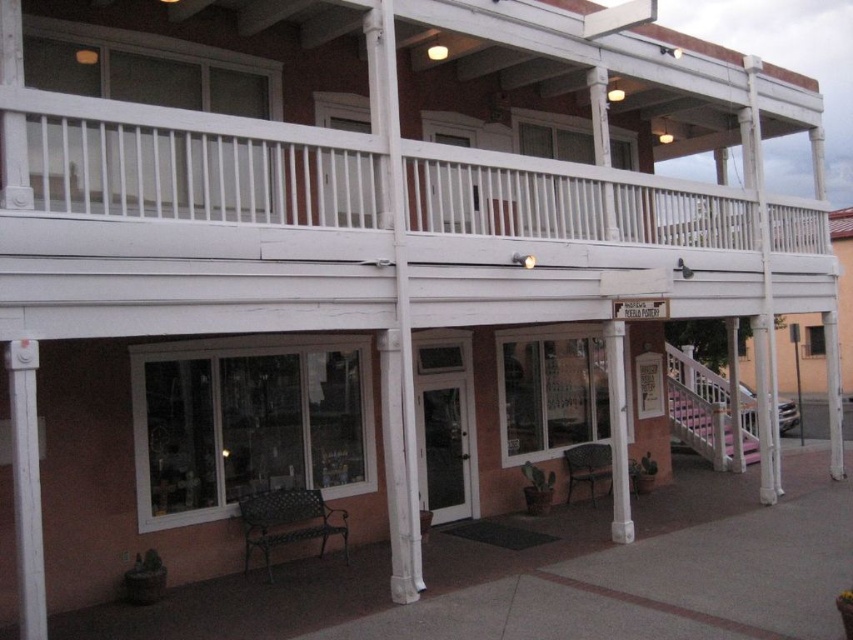
You are standing in front of the building and want to know which object is higher between the white painted wood at left and the white painted wood column at center. Can you tell me which one is higher?

The white painted wood at left is positioned over the white painted wood column at center, so it is higher than the column.

You are standing at the entrance of the two story building and want to find the white wooden railing at upper center. According to the coordinate system where the bottom left corner is the origin, can you determine if the white wooden railing at upper center is located to the left or right of the point with coordinates point (364, 177)?

The point (364, 177) corresponds to the white wooden railing at upper center, so it is exactly at that location.